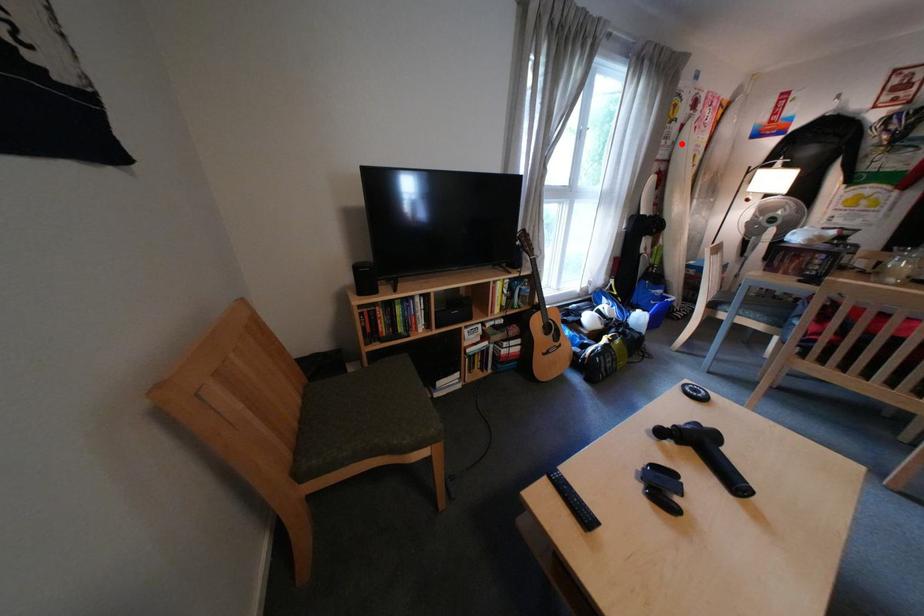
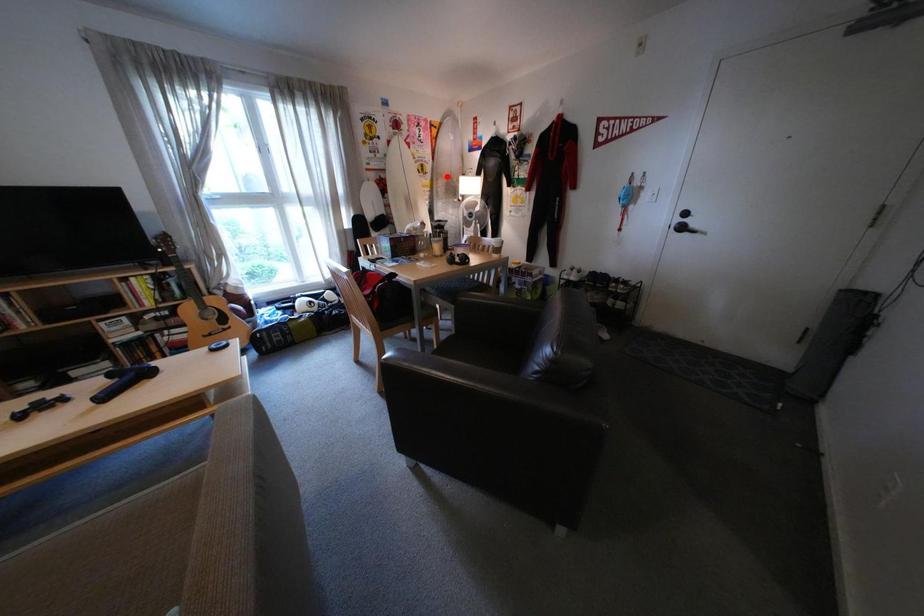
I am providing you with two images of the same scene from different viewpoints. A red point is marked on the first image and another point is marked on the second image. Are the points marked in image1 and image2 representing the same 3D position?

No